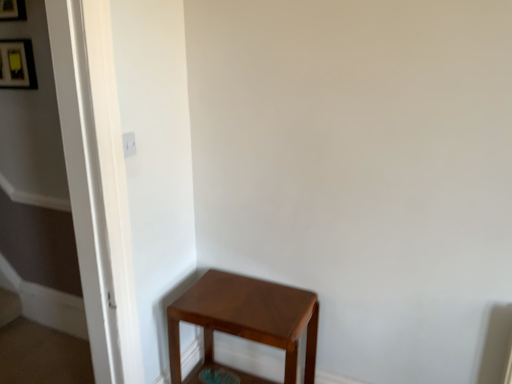
Where is `empty space that is ontop of matte brown stool at lower right (from a real-world perspective)`? empty space that is ontop of matte brown stool at lower right (from a real-world perspective) is located at coordinates (241, 297).